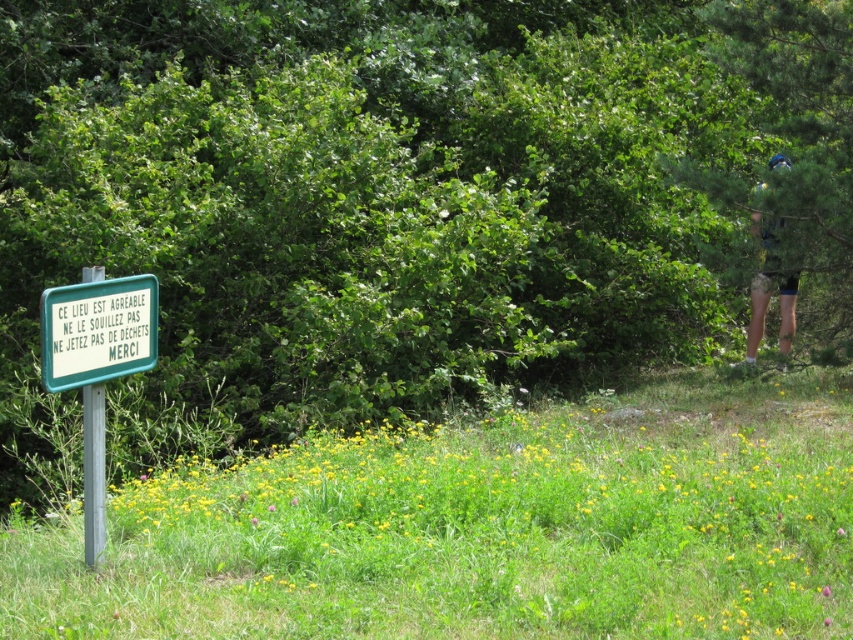
You are standing at the center of the image and want to place a 3.5 feet long wooden bench between the green grassy at left and the green plastic sign at left. Will there be enough space to place the bench horizontally between them?

The distance between the green grassy at left and the green plastic sign at left is 4.13 feet. Since the bench is 3.5 feet long, which is shorter than the available space, there is enough room to place the bench horizontally between them.

In the scene shown: You are standing at the point with coordinates (485, 529) in the image. Looking around, you see green grassy at left. Which direction should you walk to reach the signboard?

Since the green grassy at left is located to the left of your current position at point (485, 529), you should walk to the right to reach the signboard.

You are standing at the signboard in the scene. You see two points labeled point (618, 456) and point (123, 308). Which point is closer to you?

Point (123, 308) is closer because it is in front of point (618, 456).